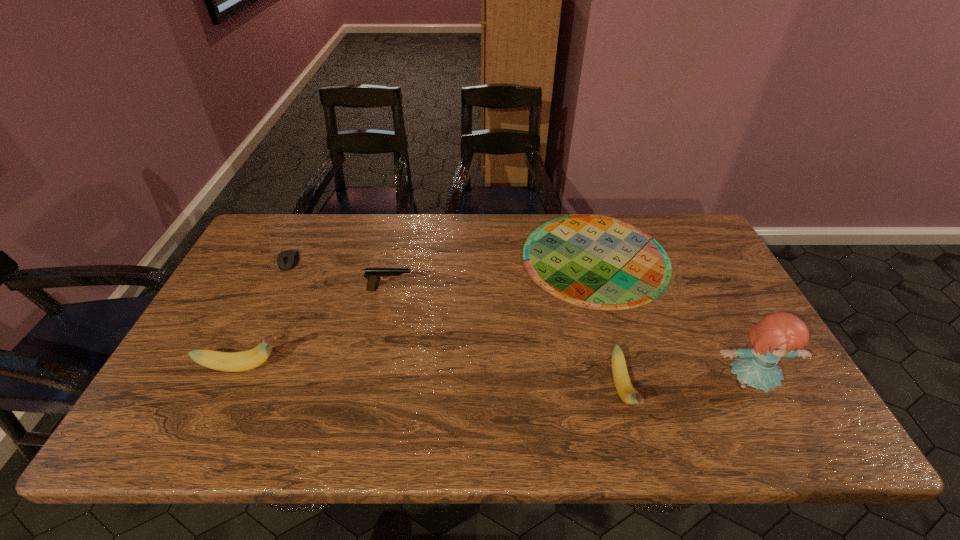
The image size is (960, 540). I want to click on free space between the computer equipment and the tallest object, so tap(518, 322).

You are a GUI agent. You are given a task and a screenshot of the screen. Output one action in this format:
    pyautogui.click(x=<x>, y=<y>)
    Task: Click on the vacant point located between the pistol and the shorter banana
    This screenshot has width=960, height=540.
    Given the screenshot: What is the action you would take?
    506,339

Locate an element on the screen. The image size is (960, 540). empty space between the gameboard and the right banana is located at coordinates (609, 323).

Find the location of `free space between the fifth tallest object and the doll`. free space between the fifth tallest object and the doll is located at coordinates (518, 322).

This screenshot has width=960, height=540. In order to click on empty location between the shortest object and the fifth tallest object in this screenshot , I will do `click(443, 260)`.

In order to click on unoccupied area between the taller banana and the third object from left to right in this screenshot , I will do `click(317, 328)`.

Identify the location of free spot between the pistol and the gameboard. This screenshot has height=540, width=960. (492, 273).

Locate an element on the screen. The width and height of the screenshot is (960, 540). object that stands as the second closest to the second shortest object is located at coordinates (246, 360).

Identify which object is the fourth nearest to the shortest object. Please provide its 2D coordinates. Your answer should be formatted as a tuple, i.e. [(x, y)], where the tuple contains the x and y coordinates of a point satisfying the conditions above.

[(246, 360)]